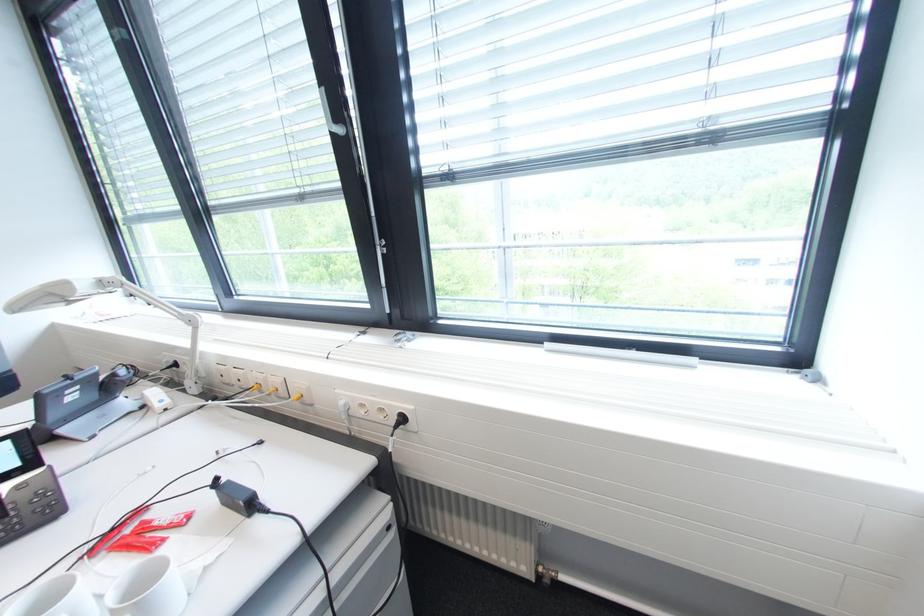
Find where to pull the blind adjustment toggle. Please return your answer as a coordinate pair (x, y).

(791, 408)